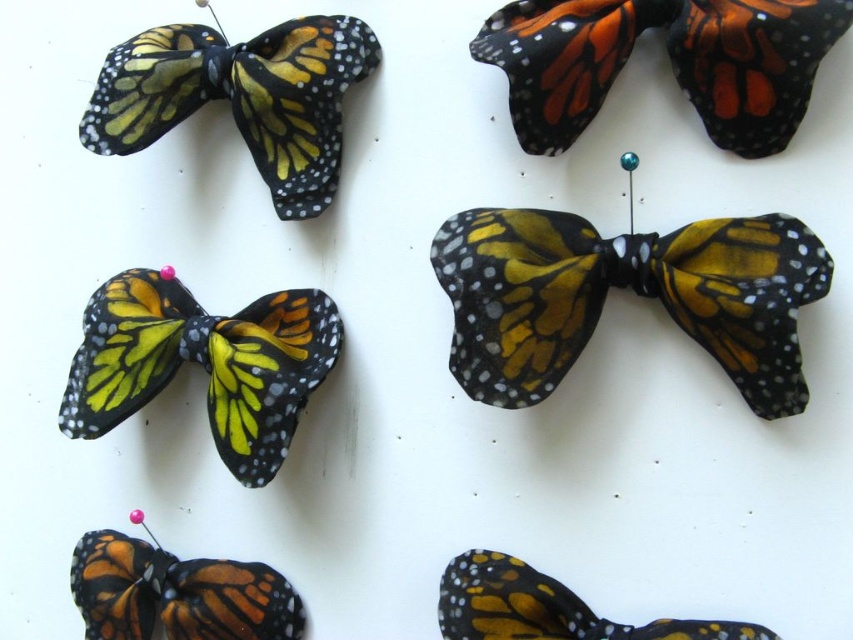
Is shiny yellow fabric butterfly at center below orange-yellow fabric butterfly at lower left?

No.

At what (x,y) coordinates should I click in order to perform the action: click on shiny yellow fabric butterfly at center. Please return your answer as a coordinate pair (x, y). This screenshot has height=640, width=853. Looking at the image, I should click on (624, 288).

Find the location of `shiny yellow fabric butterfly at center`. shiny yellow fabric butterfly at center is located at coordinates (624, 288).

Is point (486, 54) closer to viewer compared to point (222, 51)?

Yes.

Is orange matte fabric butterfly at upper center further to the viewer compared to matte fabric butterfly at upper left?

No, it is not.

You are a GUI agent. You are given a task and a screenshot of the screen. Output one action in this format:
    pyautogui.click(x=<x>, y=<y>)
    Task: Click on the orange matte fabric butterfly at upper center
    The height and width of the screenshot is (640, 853).
    Given the screenshot: What is the action you would take?
    [x=670, y=60]

Is shiny yellow fabric butterfly at center to the right of orange matte fabric butterfly at upper center from the viewer's perspective?

Incorrect, shiny yellow fabric butterfly at center is not on the right side of orange matte fabric butterfly at upper center.

Which is behind, point (730, 371) or point (791, 29)?

Point (730, 371)

Between point (543, 392) and point (564, 86), which one is positioned behind?

Point (564, 86)

Locate an element on the screen. shiny yellow fabric butterfly at center is located at coordinates (624, 288).